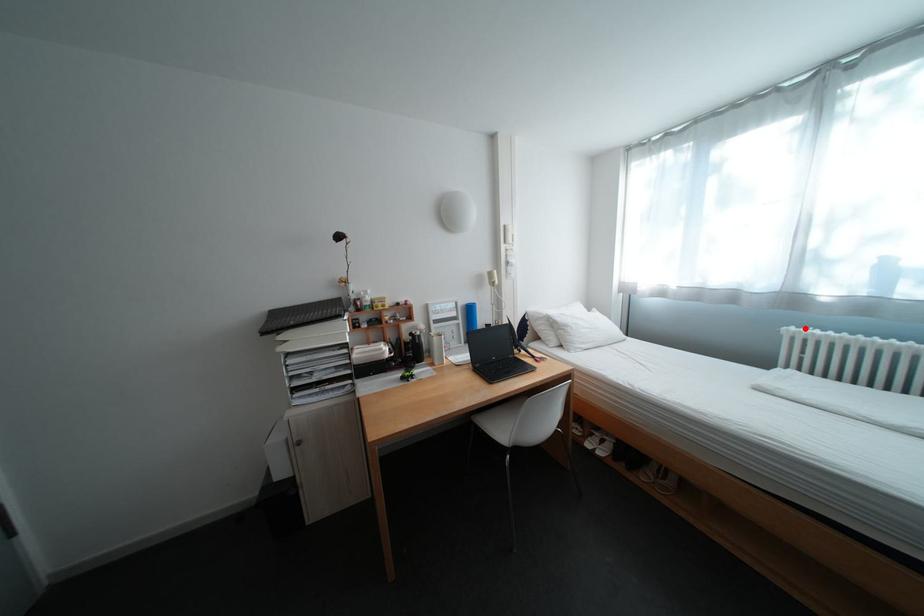
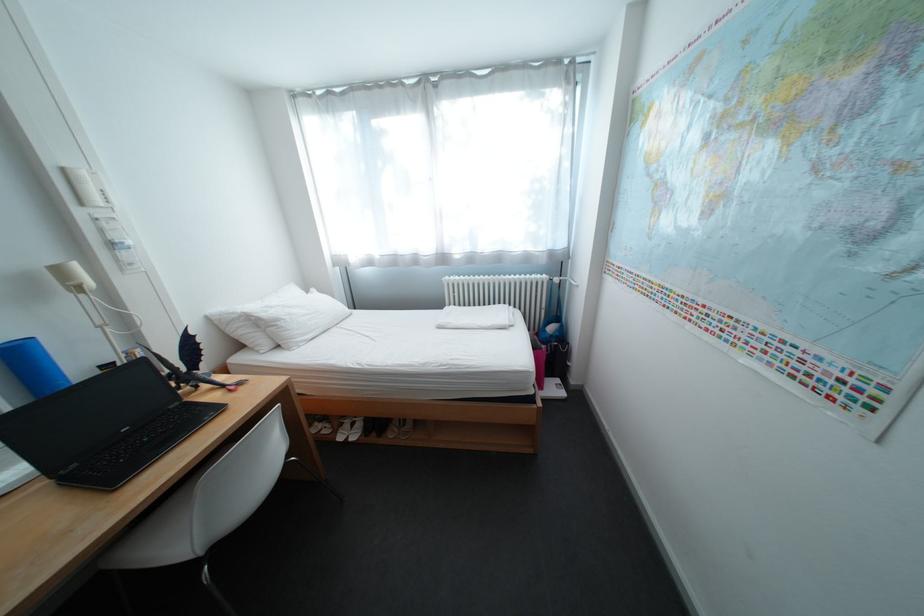
Where in the second image is the point corresponding to the highlighted location from the first image?

(459, 278)